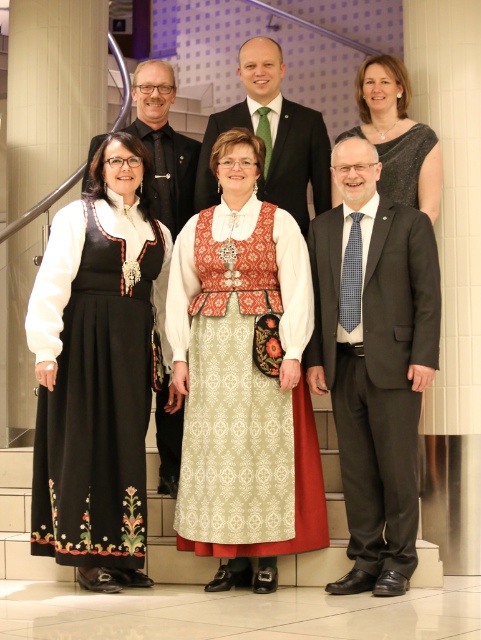
You are a photographer adjusting your camera settings to capture the group photo. You notice the green textured tie at upper center and the matte black suit at center. Which object is closer to the camera?

The green textured tie at upper center is positioned over the matte black suit at center, indicating it is closer to the camera.

You are a photographer setting up for a group photo. You need to ensure that the dark gray suit at center and the green textured tie at upper center are both visible in the frame. Given their sizes, which one might require more careful positioning to avoid being obscured?

The dark gray suit at center is thinner than the green textured tie at upper center, so the dark gray suit at center might require more careful positioning to avoid being obscured because it is smaller in width.

You are a photographer setting up for a group photo. You need to ensure that the patterned fabric dress at center and the black satin dress at upper center are both visible in the frame. Given their heights, which dress should be positioned closer to the front to avoid blocking the other?

The black satin dress at upper center is shorter than the patterned fabric dress at center. To ensure both are visible, the black satin dress at upper center should be positioned closer to the front so it doesn